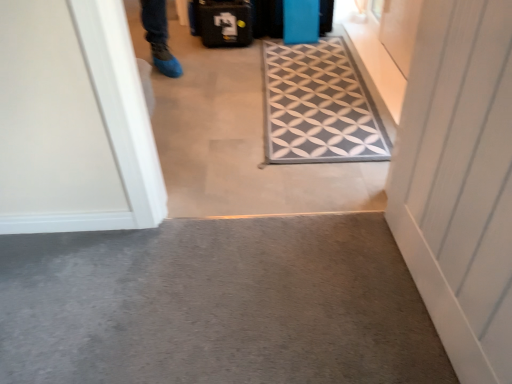
The height and width of the screenshot is (384, 512). What are the coordinates of `white wood door at right` in the screenshot? It's located at (459, 181).

What do you see at coordinates (224, 22) in the screenshot?
I see `black textured suitcase at upper center, which ranks as the 2th luggage in right-to-left order` at bounding box center [224, 22].

Image resolution: width=512 pixels, height=384 pixels. Identify the location of carpeted floor at center. tap(239, 142).

Does gray fabric doormat at center come behind blue matte suitcase at upper center, the second luggage viewed from the left?

No, gray fabric doormat at center is in front of blue matte suitcase at upper center, the second luggage viewed from the left.

Can you tell me how much gray fabric doormat at center and blue matte suitcase at upper center, the second luggage viewed from the left, differ in facing direction?

The angle between the facing direction of gray fabric doormat at center and the facing direction of blue matte suitcase at upper center, the second luggage viewed from the left, is 88.8 degrees.

Could you tell me if gray fabric doormat at center is facing blue matte suitcase at upper center, which is the first luggage in right-to-left order?

No, gray fabric doormat at center is not oriented towards blue matte suitcase at upper center, which is the first luggage in right-to-left order.

Is blue matte suitcase at upper center, the second luggage viewed from the left, inside gray fabric doormat at center?

Definitely not — blue matte suitcase at upper center, the second luggage viewed from the left, is not inside gray fabric doormat at center.

Considering the positions of objects black textured suitcase at upper center, the 1th luggage viewed from the left, and gray fabric doormat at center in the image provided, who is more to the right, black textured suitcase at upper center, the 1th luggage viewed from the left, or gray fabric doormat at center?

gray fabric doormat at center.

Consider the image. Is black textured suitcase at upper center, the 1th luggage viewed from the left, looking in the opposite direction of gray fabric doormat at center?

No, black textured suitcase at upper center, the 1th luggage viewed from the left,'s orientation is not away from gray fabric doormat at center.

Which of these two, black textured suitcase at upper center, the 1th luggage viewed from the left, or gray fabric doormat at center, is bigger?

Bigger between the two is black textured suitcase at upper center, the 1th luggage viewed from the left.

Is gray fabric doormat at center spatially inside white wood door at right, or outside of it?

gray fabric doormat at center is outside white wood door at right.

Considering the points (347, 106) and (440, 287), which point is behind, point (347, 106) or point (440, 287)?

The point (347, 106) is farther.

Looking at this image, can you confirm if gray fabric doormat at center is taller than white wood door at right?

No, gray fabric doormat at center is not taller than white wood door at right.

Is gray carpet at lower center positioned beyond the bounds of black textured suitcase at upper center, which ranks as the 2th luggage in right-to-left order?

gray carpet at lower center is positioned outside black textured suitcase at upper center, which ranks as the 2th luggage in right-to-left order.

From a real-world perspective, is gray carpet at lower center physically above black textured suitcase at upper center, the 1th luggage viewed from the left?

No, from a real-world perspective, gray carpet at lower center is not over black textured suitcase at upper center, the 1th luggage viewed from the left

Which object is more forward, gray carpet at lower center or black textured suitcase at upper center, the 1th luggage viewed from the left?

Positioned in front is gray carpet at lower center.

Are gray carpet at lower center and black textured suitcase at upper center, which ranks as the 2th luggage in right-to-left order, located far from each other?

gray carpet at lower center is positioned a significant distance from black textured suitcase at upper center, which ranks as the 2th luggage in right-to-left order.

Is gray carpet at lower center surrounded by white wood door at right?

No, gray carpet at lower center is located outside of white wood door at right.

Is white wood door at right oriented towards gray carpet at lower center?

Yes, white wood door at right is turned towards gray carpet at lower center.

Are white wood door at right and gray carpet at lower center far apart?

white wood door at right is near gray carpet at lower center, not far away.

You are a GUI agent. You are given a task and a screenshot of the screen. Output one action in this format:
    pyautogui.click(x=<x>, y=<y>)
    Task: Click on the concrete located below the white wood door at right (from the image's perspective)
    
    Given the screenshot: What is the action you would take?
    (x=216, y=305)

In the scene shown: Is carpeted floor at center surrounding gray fabric doormat at center?

Actually, gray fabric doormat at center is outside carpeted floor at center.

Is point (251, 60) closer or farther from the camera than point (381, 150)?

Clearly, point (251, 60) is more distant from the camera than point (381, 150).

In terms of size, does carpeted floor at center appear bigger or smaller than gray fabric doormat at center?

Clearly, carpeted floor at center is larger in size than gray fabric doormat at center.

From a real-world perspective, which is physically below, gray carpet at lower center or blue matte suitcase at upper center, the second luggage viewed from the left?

gray carpet at lower center is physically lower.

Does gray carpet at lower center turn towards blue matte suitcase at upper center, the second luggage viewed from the left?

No, gray carpet at lower center is not facing towards blue matte suitcase at upper center, the second luggage viewed from the left.

Considering the positions of objects gray carpet at lower center and blue matte suitcase at upper center, the second luggage viewed from the left, in the image provided, who is more to the left, gray carpet at lower center or blue matte suitcase at upper center, the second luggage viewed from the left,?

→ Positioned to the left is gray carpet at lower center.

Which is further, [267,368] or [316,10]?

The point [316,10] is farther.

You are a GUI agent. You are given a task and a screenshot of the screen. Output one action in this format:
    pyautogui.click(x=<x>, y=<y>)
    Task: Click on the 1st luggage behind the gray fabric doormat at center
    The image size is (512, 384).
    Given the screenshot: What is the action you would take?
    pyautogui.click(x=300, y=21)

The height and width of the screenshot is (384, 512). I want to click on doormat below the black textured suitcase at upper center, the 1th luggage viewed from the left (from the image's perspective), so click(319, 106).

Which object lies further to the anchor point blue matte suitcase at upper center, which is the first luggage in right-to-left order, gray carpet at lower center or white wood door at right?

gray carpet at lower center lies further to blue matte suitcase at upper center, which is the first luggage in right-to-left order, than the other object.

Looking at the image, which one is located closer to gray carpet at lower center, black textured suitcase at upper center, the 1th luggage viewed from the left, or blue matte suitcase at upper center, the second luggage viewed from the left?

black textured suitcase at upper center, the 1th luggage viewed from the left, is closer to gray carpet at lower center.

Which object lies further to the anchor point gray fabric doormat at center, carpeted floor at center or white wood door at right?

Among the two, white wood door at right is located further to gray fabric doormat at center.

Considering their positions, is blue matte suitcase at upper center, which is the first luggage in right-to-left order, positioned closer to black textured suitcase at upper center, which ranks as the 2th luggage in right-to-left order, than carpeted floor at center?

The object closer to black textured suitcase at upper center, which ranks as the 2th luggage in right-to-left order, is blue matte suitcase at upper center, which is the first luggage in right-to-left order.

Considering their positions, is black textured suitcase at upper center, which ranks as the 2th luggage in right-to-left order, positioned further to blue matte suitcase at upper center, the second luggage viewed from the left, than gray fabric doormat at center?

gray fabric doormat at center lies further to blue matte suitcase at upper center, the second luggage viewed from the left, than the other object.

Considering their positions, is gray carpet at lower center positioned closer to carpeted floor at center than white wood door at right?

The object closer to carpeted floor at center is gray carpet at lower center.

Looking at this image, looking at the image, which one is located closer to gray carpet at lower center, blue matte suitcase at upper center, which is the first luggage in right-to-left order, or gray fabric doormat at center?

The object closer to gray carpet at lower center is gray fabric doormat at center.

Estimate the real-world distances between objects in this image. Which object is closer to white wood door at right, carpeted floor at center or black textured suitcase at upper center, which ranks as the 2th luggage in right-to-left order?

carpeted floor at center.

I want to click on concrete between white wood door at right and black textured suitcase at upper center, the 1th luggage viewed from the left, along the z-axis, so click(216, 305).

At what (x,y) coordinates should I click in order to perform the action: click on luggage located between white wood door at right and black textured suitcase at upper center, the 1th luggage viewed from the left, in the depth direction. Please return your answer as a coordinate pair (x, y). Looking at the image, I should click on (x=300, y=21).

This screenshot has width=512, height=384. Find the location of `concrete located between carpeted floor at center and black textured suitcase at upper center, which ranks as the 2th luggage in right-to-left order, in the depth direction`. concrete located between carpeted floor at center and black textured suitcase at upper center, which ranks as the 2th luggage in right-to-left order, in the depth direction is located at coordinates (216, 305).

Where is `passage located between white wood door at right and black textured suitcase at upper center, which ranks as the 2th luggage in right-to-left order, in the depth direction`? Image resolution: width=512 pixels, height=384 pixels. passage located between white wood door at right and black textured suitcase at upper center, which ranks as the 2th luggage in right-to-left order, in the depth direction is located at coordinates (239, 142).